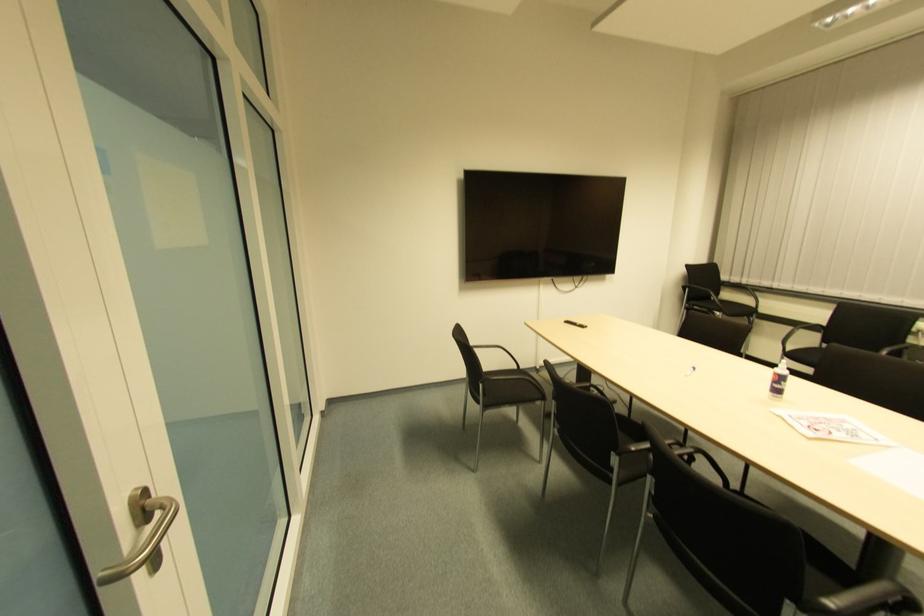
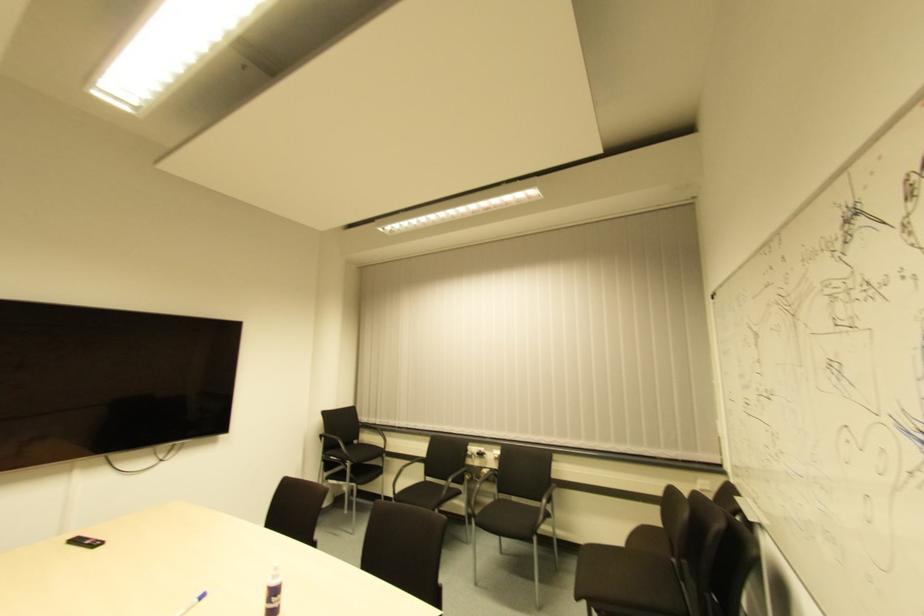
In the second image, find the point that corresponds to point (752, 310) in the first image.

(381, 448)